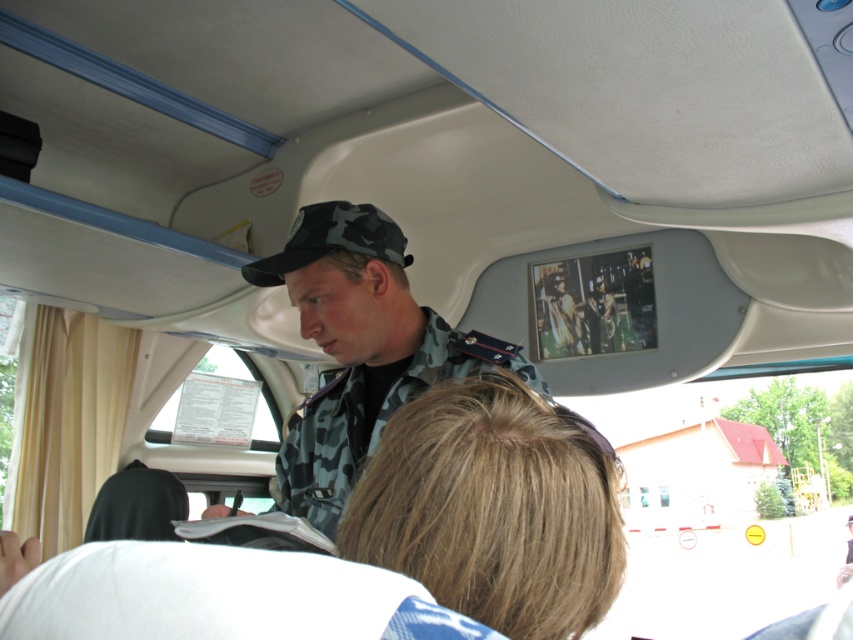
You are a passenger on the bus and you notice two camouflage items at the front of the bus. The camouflage uniform at center and the camouflage fabric baseball cap at upper center. Which one is bigger?

The camouflage uniform at center is larger than the camouflage fabric baseball cap at upper center.

You are a passenger on the bus and want to place a small bag on the floor. The bag requires a space of at least 10 cm in length. Can you determine if the white fabric at lower center has enough space for it?

The white fabric at lower center is located at point (219, 596). However, the exact dimensions of the white fabric at lower center are not provided in the Objects Description, so it is impossible to determine if it has enough space for the bag.